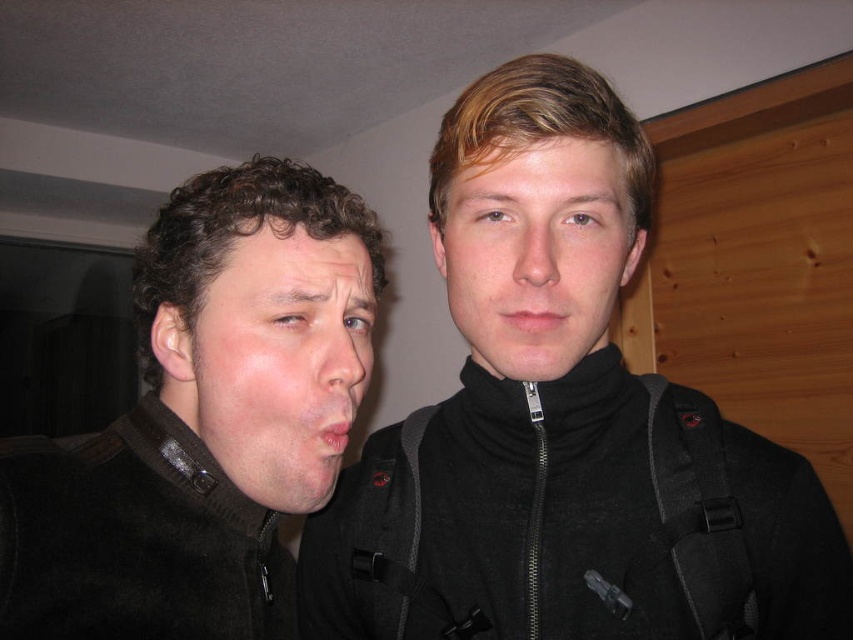
Can you confirm if matte black face at left is wider than dry matte lips at center?

Correct, the width of matte black face at left exceeds that of dry matte lips at center.

Does matte black face at left appear under dry matte lips at center?

No, matte black face at left is not below dry matte lips at center.

Find the location of a particular element. Image resolution: width=853 pixels, height=640 pixels. matte black face at left is located at coordinates (276, 358).

You are a GUI agent. You are given a task and a screenshot of the screen. Output one action in this format:
    pyautogui.click(x=<x>, y=<y>)
    Task: Click on the matte black face at left
    The height and width of the screenshot is (640, 853).
    Given the screenshot: What is the action you would take?
    pyautogui.click(x=276, y=358)

How much distance is there between smooth skin face at center and dry matte lips at center?

smooth skin face at center and dry matte lips at center are 5.19 inches apart.

Can you confirm if smooth skin face at center is smaller than dry matte lips at center?

Incorrect, smooth skin face at center is not smaller in size than dry matte lips at center.

In order to click on smooth skin face at center in this screenshot , I will do `click(537, 250)`.

Can you confirm if black matte jacket at upper right is smaller than matte black mouth at center?

Actually, black matte jacket at upper right might be larger than matte black mouth at center.

Is point (628, 195) behind point (546, 317)?

Yes, it is behind point (546, 317).

Describe the element at coordinates (563, 426) in the screenshot. This screenshot has width=853, height=640. I see `black matte jacket at upper right` at that location.

The width and height of the screenshot is (853, 640). I want to click on black matte jacket at upper right, so click(x=563, y=426).